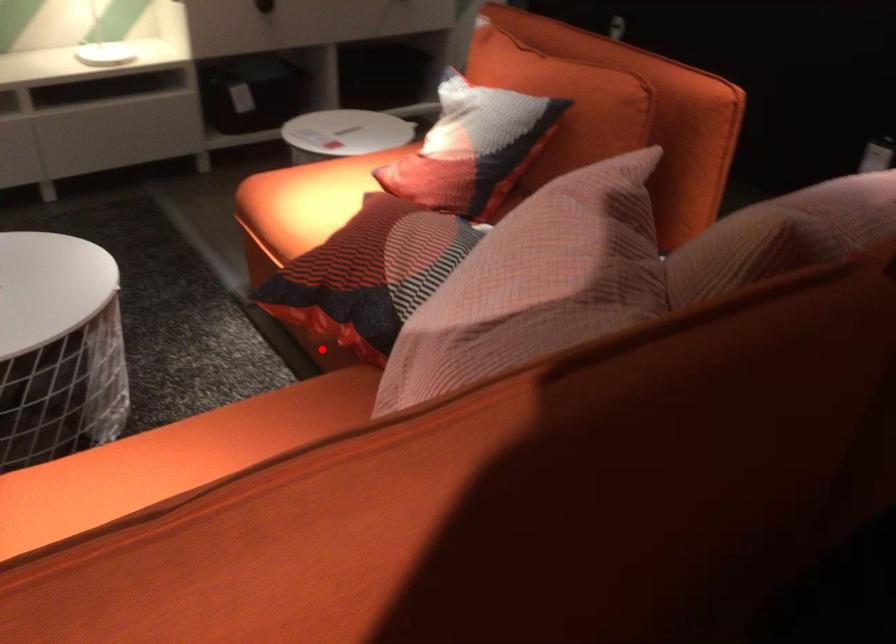
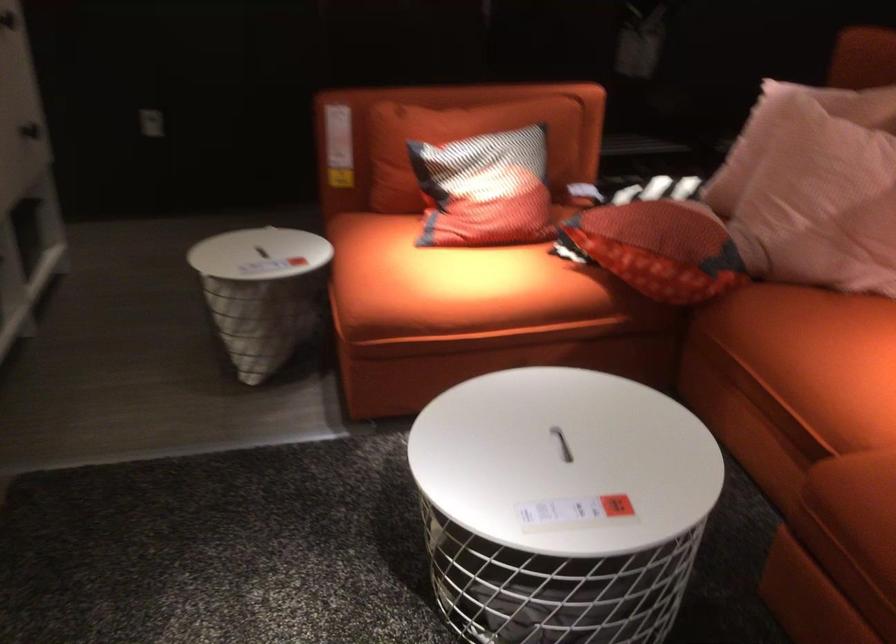
Question: I am providing you with two images of the same scene from different viewpoints. A red point is marked on the first image. Is the red point's position out of view in image 2?

Choices:
 (A) Yes
 (B) No

Answer: (A)